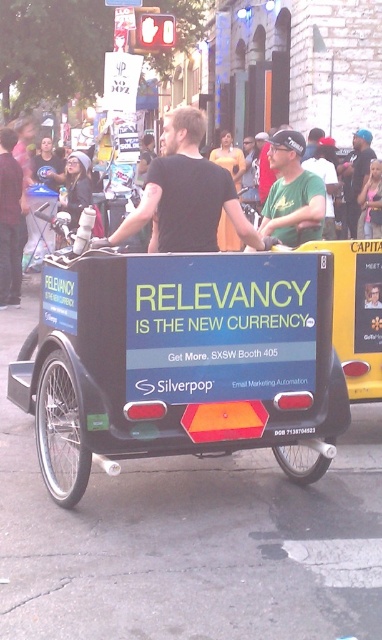
Question: Which object is positioned farthest from the dark blue t-shirt at center?

Choices:
 (A) green matte shirt at center
 (B) black matte shirt at center

Answer: (B)

Question: Where is green matte shirt at center located in relation to dark blue t-shirt at center in the image?

Choices:
 (A) above
 (B) below

Answer: (B)

Question: Considering the relative positions of green matte shirt at center and dark blue t-shirt at center in the image provided, where is green matte shirt at center located with respect to dark blue t-shirt at center?

Choices:
 (A) left
 (B) right

Answer: (A)

Question: Which point appears closest to the camera in this image?

Choices:
 (A) (310, 212)
 (B) (126, 230)
 (C) (351, 218)

Answer: (B)

Question: Which of the following is the closest to the observer?

Choices:
 (A) (315, 228)
 (B) (367, 140)

Answer: (A)

Question: Can you confirm if black matte shirt at center is positioned below green matte shirt at center?

Choices:
 (A) no
 (B) yes

Answer: (B)